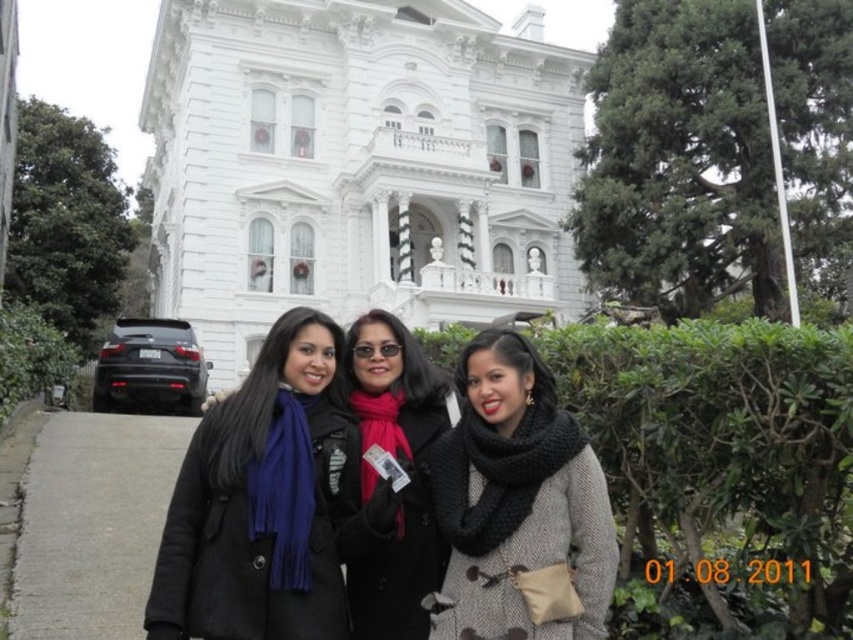
Who is positioned more to the left, black knitted scarf at center or matte black coat at center?

From the viewer's perspective, matte black coat at center appears more on the left side.

Is black knitted scarf at center in front of matte black coat at center?

That is True.

Which is behind, point (492, 452) or point (422, 406)?

The point (422, 406) is more distant.

The height and width of the screenshot is (640, 853). Identify the location of black knitted scarf at center. (518, 504).

Looking at this image, can you confirm if green leafy hedge at lower right is positioned to the right of gray concrete pavement at lower left?

Yes, green leafy hedge at lower right is to the right of gray concrete pavement at lower left.

Is point (561, 352) closer to viewer compared to point (137, 435)?

Yes, point (561, 352) is in front of point (137, 435).

This screenshot has width=853, height=640. What are the coordinates of `green leafy hedge at lower right` in the screenshot? It's located at (722, 451).

Is blue scarf at center in front of matte black coat at center?

Yes, it is.

Does blue scarf at center appear on the right side of matte black coat at center?

No, blue scarf at center is not to the right of matte black coat at center.

Is point (308, 520) closer to viewer compared to point (346, 525)?

That is True.

At what (x,y) coordinates should I click in order to perform the action: click on blue scarf at center. Please return your answer as a coordinate pair (x, y). This screenshot has height=640, width=853. Looking at the image, I should click on (263, 500).